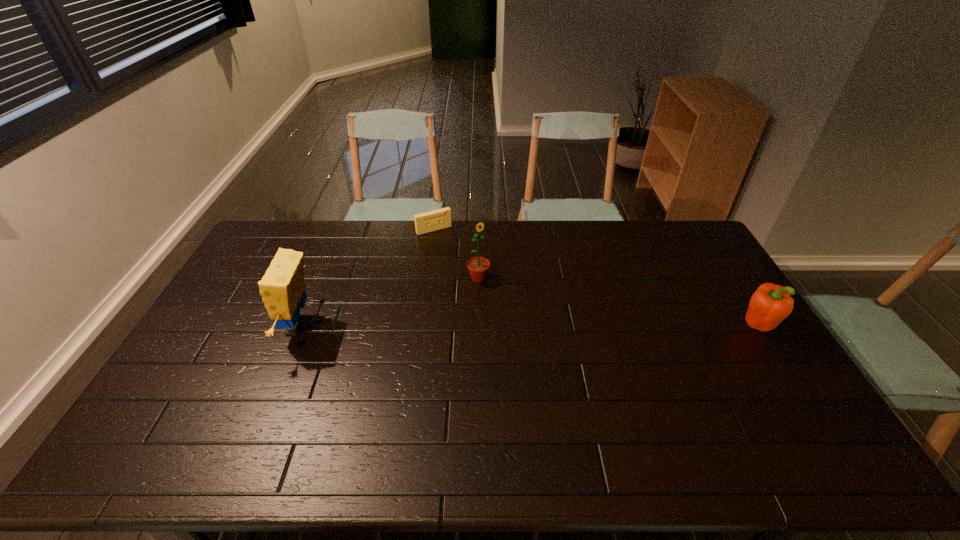
Where is `vacant space on the desktop that is between the sponge and the second shortest object and is positioned on the face of the second farthest object`? The image size is (960, 540). vacant space on the desktop that is between the sponge and the second shortest object and is positioned on the face of the second farthest object is located at coordinates (519, 327).

Where is `vacant space on the desktop that is between the leftmost object and the pepper and is positioned at the front of the farthest object with spools`? The image size is (960, 540). vacant space on the desktop that is between the leftmost object and the pepper and is positioned at the front of the farthest object with spools is located at coordinates (498, 326).